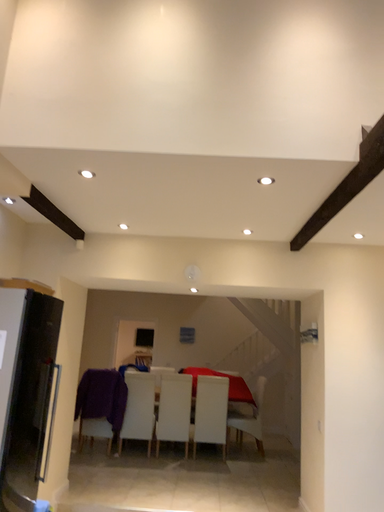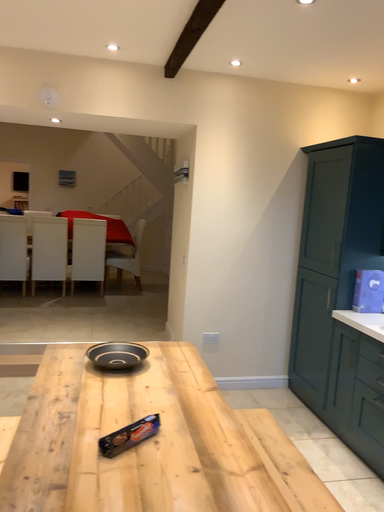
Question: How did the camera likely rotate when shooting the video?

Choices:
 (A) rotated left
 (B) rotated right

Answer: (B)